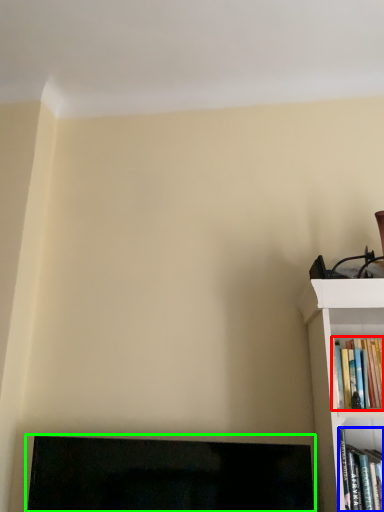
Question: Which is farther away from book (highlighted by a red box)? book (highlighted by a blue box) or fireplace (highlighted by a green box)?

Choices:
 (A) book
 (B) fireplace

Answer: (B)